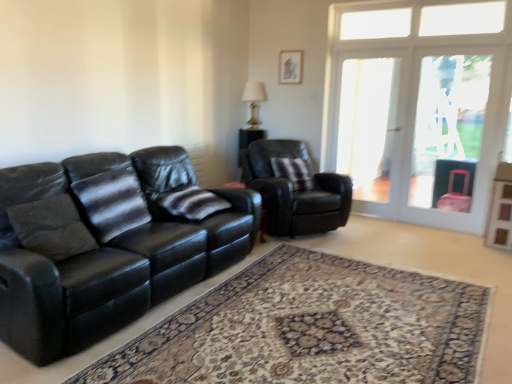
Question: Is striped fabric pillow at center, the 2th pillow positioned from the back, wider or thinner than striped fabric pillow at center, which appears as the 1th pillow when viewed from the back?

Choices:
 (A) thin
 (B) wide

Answer: (B)

Question: Relative to striped fabric pillow at center, the third pillow from the left, is striped fabric pillow at center, the 2th pillow positioned from the back, in front or behind?

Choices:
 (A) behind
 (B) front

Answer: (B)

Question: Based on their relative distances, which object is farther from the transparent glass screen door at right, the 1th screen door positioned from the left?

Choices:
 (A) black leather armchair at center
 (B) carpeted rug at center
 (C) striped fabric pillow at left, which is the third pillow in right-to-left order
 (D) striped fabric pillow at center, which appears as the 1th pillow when viewed from the back
 (E) black leather couch at left

Answer: (C)

Question: Which of these objects is positioned closest to the striped fabric pillow at left, which is the third pillow in right-to-left order?

Choices:
 (A) clear glass screen door at right, acting as the 2th screen door starting from the left
 (B) striped fabric pillow at center, which appears as the 1th pillow when viewed from the back
 (C) black leather armchair at center
 (D) matte glass lamp at upper center
 (E) black leather couch at left

Answer: (E)